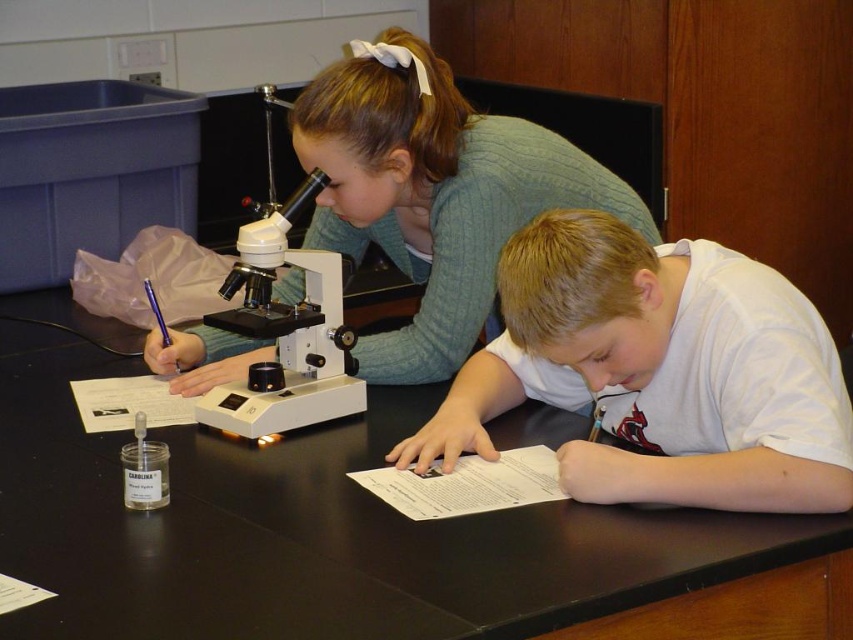
Imagine you are standing at the edge of the laboratory table looking towards the center. There are two points marked on the table surface. The first point is at coordinates point (619, 323) and the second point is at point (483, 246). Which point is closer to you?

Point (619, 323) is in front of point (483, 246), so it is closer to you.

From the picture: You are a student in the lab and need to hand in your lab report. You see the white matte shirt at center and the green sweater at upper center. Which one is closer to you?

The white matte shirt at center is closer to you because it is below the green sweater at upper center, indicating it is positioned lower in the visual plane.

You are a student who wants to place a small notebook on the table without covering any objects. Given the sizes of the white matte shirt at center and the white plastic microscope at center, which object should you place the notebook next to to ensure it doesn

The white matte shirt at center is larger than the white plastic microscope at center. To place the notebook without covering objects, place it next to the white plastic microscope at center, as it occupies less space.